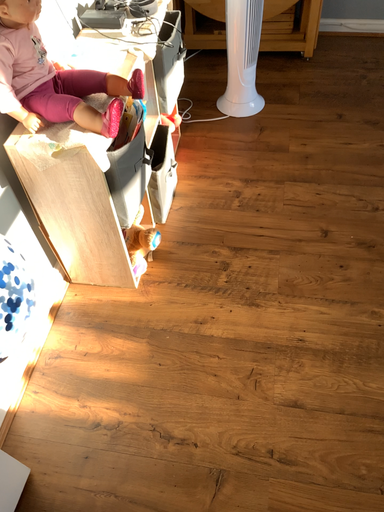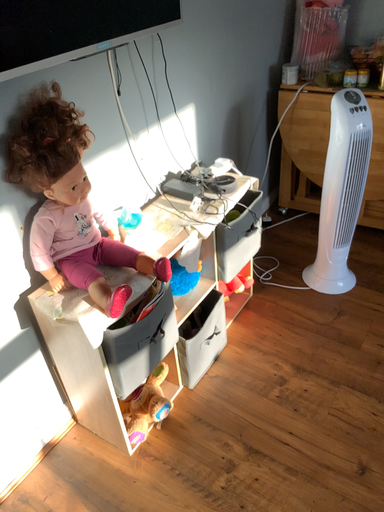
Question: Which way did the camera rotate in the video?

Choices:
 (A) rotated downward
 (B) rotated upward

Answer: (B)